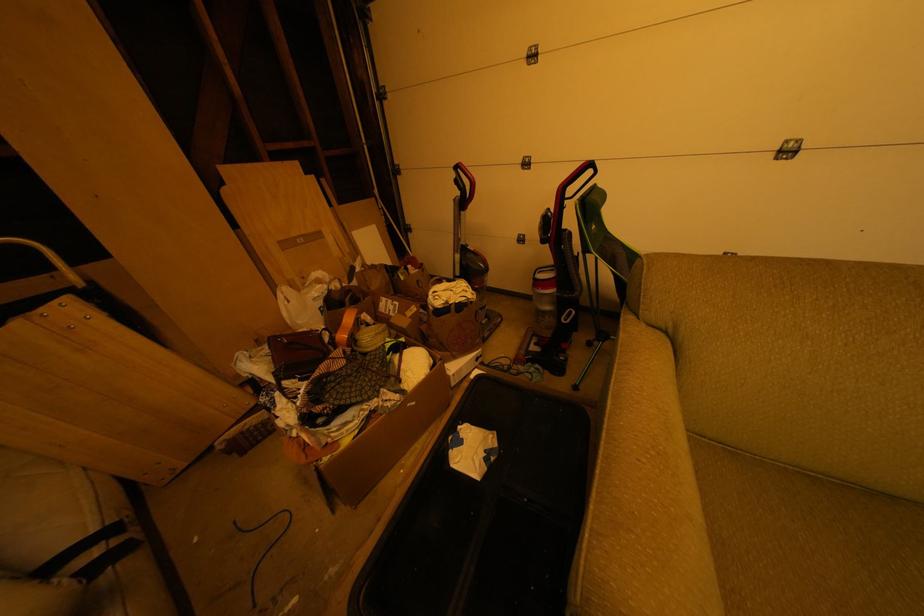
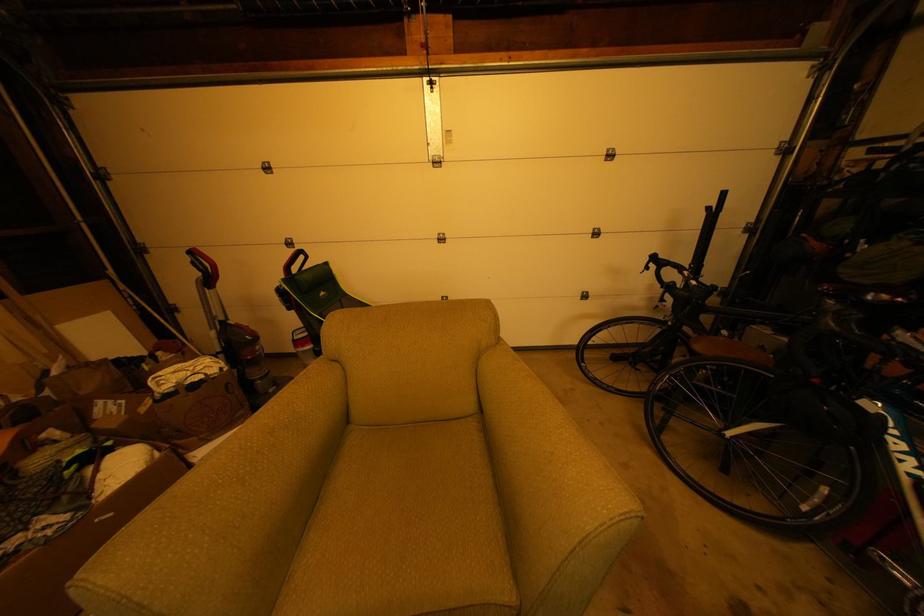
Question: The images are taken continuously from a first-person perspective. In which direction is your viewpoint rotating?

Choices:
 (A) Left
 (B) Right
 (C) Up
 (D) Down

Answer: (B)